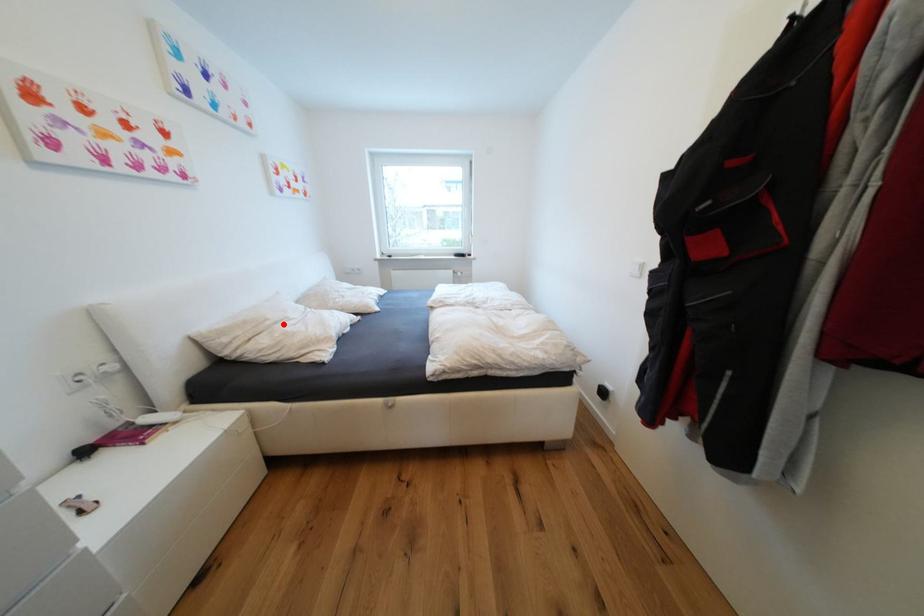
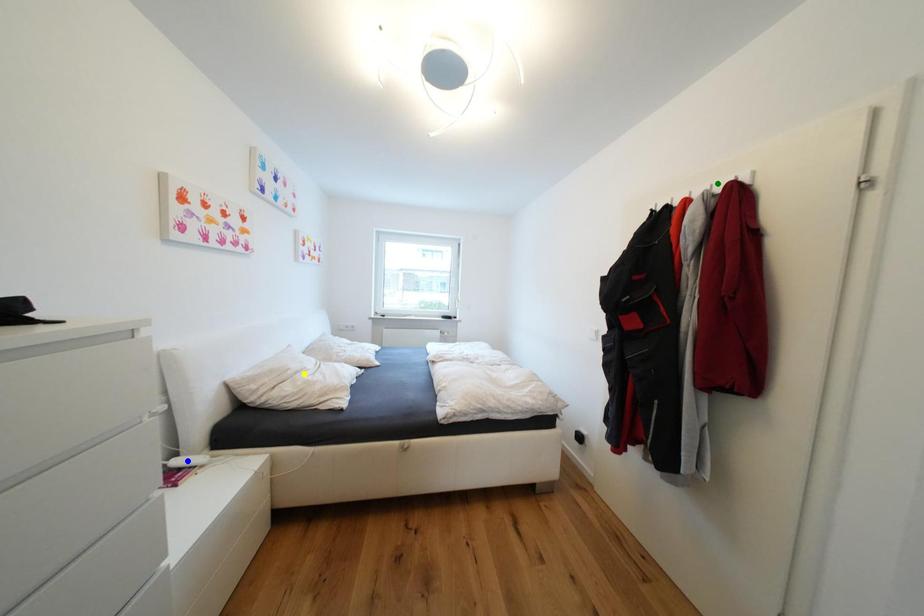
Question: I am providing you with two images of the same scene from different viewpoints. A red point is marked on the first image. You are given multiple points on the second image. Can you choose the point in image 2 that corresponds to the point in image 1?

Choices:
 (A) green point
 (B) blue point
 (C) yellow point

Answer: (C)